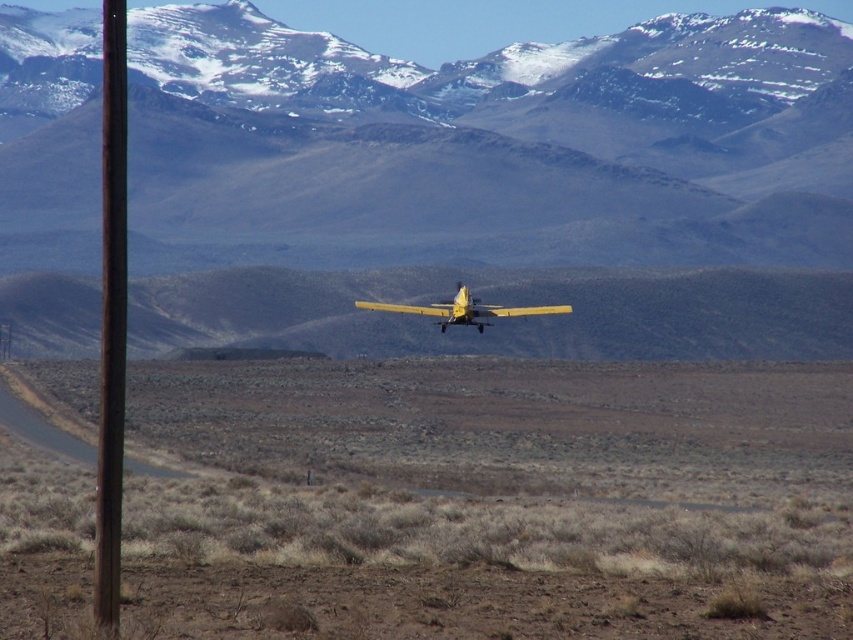
You are a drone operator trying to navigate between two points in the desert scene. The first point is labeled as point (105, 348) and the second is point (483, 312). Which point is closer to the observer?

Point (105, 348) is in front of point (483, 312), so it is closer to the observer.

You are a pilot flying the yellow matte airplane at center and need to land on the brown dirt at center. Can you safely land on the dirt since it is positioned to the right of the airplane?

The brown dirt at center is to the right of the yellow matte airplane at center, so you can safely land on the dirt as it is positioned to the right of the airplane.

You are a drone operator flying a drone over the desert landscape. You need to avoid obstacles while navigating. The drone is currently at coordinates 0.5, 0.1. Is the rusty metal pole at left within 0.05 units of your current position?

The rusty metal pole at left is at point (111, 317). The drone is at (84, 320). The distance between them is sqrt squared difference between x and y coordinates. The x difference is 0.002, y difference is 0.031. The total distance is sqrt of 0.002 squared plus 0.031 squared, which is approximately sqrt of 0.000004 plus 0.000961 equals sqrt of 0.000965, which is about 0.031 units. Since 0.031 is less than 0.05, the rusty metal pole at left is within 0.05 units of the drone.